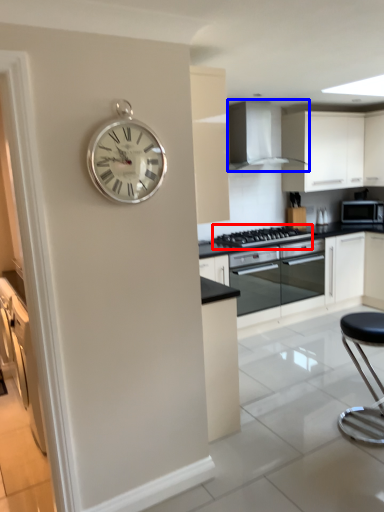
Question: Which point is further to the camera, gas stove (highlighted by a red box) or home appliance (highlighted by a blue box)?

Choices:
 (A) gas stove
 (B) home appliance

Answer: (A)